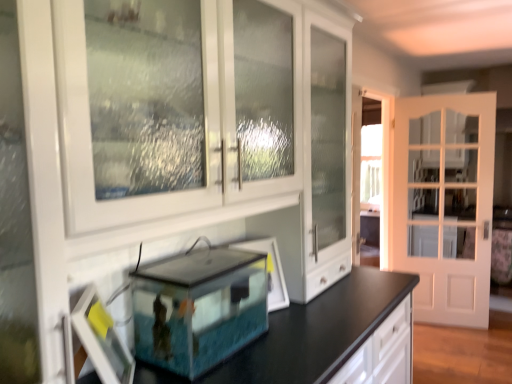
Question: Is matte white picture frame at lower left, the 1th picture frame viewed from the left, wider or thinner than transparent glass tank at center?

Choices:
 (A) wide
 (B) thin

Answer: (B)

Question: In terms of size, does matte white picture frame at lower left, positioned as the 2th picture frame in right-to-left order, appear bigger or smaller than transparent glass tank at center?

Choices:
 (A) small
 (B) big

Answer: (A)

Question: Considering the real-world distances, which object is closest to the matte white picture frame at lower left, the 1th picture frame from the front?

Choices:
 (A) white glossy cabinet at center
 (B) white glass door at right
 (C) clear glass picture frame at center, arranged as the second picture frame when viewed from the front
 (D) transparent glass tank at center

Answer: (D)

Question: Which is farther from the transparent glass tank at center?

Choices:
 (A) matte white picture frame at lower left, the second picture frame in the back-to-front sequence
 (B) white glass door at right
 (C) white glossy cabinet at center
 (D) clear glass picture frame at center, arranged as the second picture frame when viewed from the front

Answer: (B)